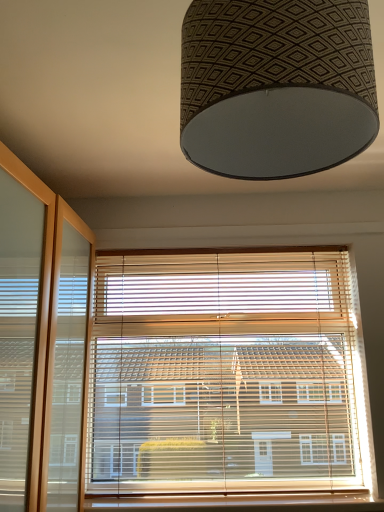
Question: From a real-world perspective, is wooden at lower center on top of patterned fabric lampshade at upper center?

Choices:
 (A) yes
 (B) no

Answer: (B)

Question: Can you confirm if wooden at lower center is smaller than patterned fabric lampshade at upper center?

Choices:
 (A) yes
 (B) no

Answer: (A)

Question: From the image's perspective, is wooden at lower center on patterned fabric lampshade at upper center?

Choices:
 (A) no
 (B) yes

Answer: (A)

Question: Is wooden at lower center behind patterned fabric lampshade at upper center?

Choices:
 (A) no
 (B) yes

Answer: (B)

Question: Is wooden at lower center to the left of patterned fabric lampshade at upper center from the viewer's perspective?

Choices:
 (A) no
 (B) yes

Answer: (A)

Question: Is wooden at lower center positioned far away from patterned fabric lampshade at upper center?

Choices:
 (A) no
 (B) yes

Answer: (B)

Question: Is patterned fabric lampshade at upper center oriented towards wooden at lower center?

Choices:
 (A) no
 (B) yes

Answer: (A)

Question: Does patterned fabric lampshade at upper center have a larger size compared to wooden at lower center?

Choices:
 (A) yes
 (B) no

Answer: (A)

Question: From the image's perspective, does patterned fabric lampshade at upper center appear higher than wooden at lower center?

Choices:
 (A) yes
 (B) no

Answer: (A)

Question: Are patterned fabric lampshade at upper center and wooden at lower center making contact?

Choices:
 (A) no
 (B) yes

Answer: (A)

Question: Is patterned fabric lampshade at upper center at the left side of wooden at lower center?

Choices:
 (A) yes
 (B) no

Answer: (A)

Question: From a real-world perspective, is patterned fabric lampshade at upper center on top of wooden at lower center?

Choices:
 (A) no
 (B) yes

Answer: (B)

Question: Does patterned fabric lampshade at upper center have a lesser width compared to wooden blinds at center?

Choices:
 (A) yes
 (B) no

Answer: (B)